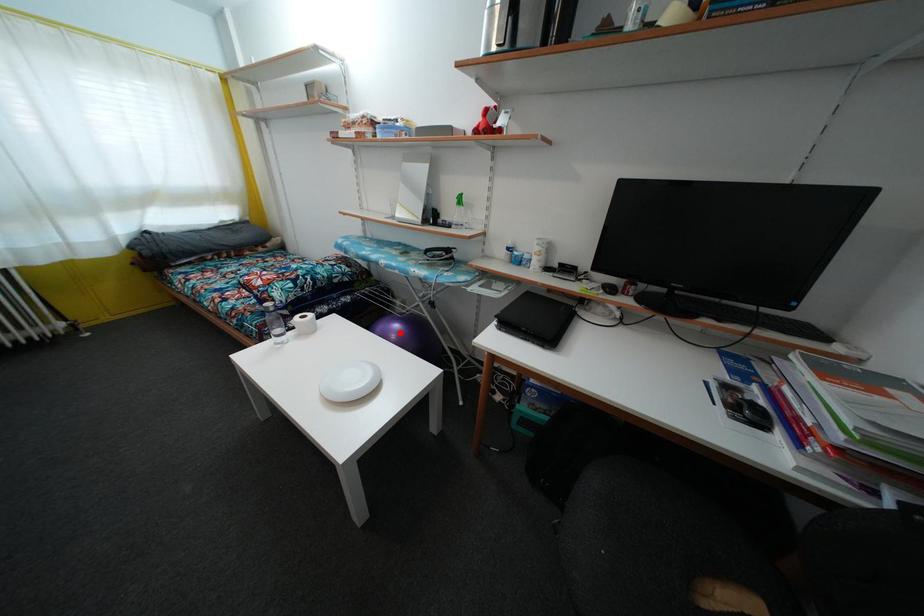
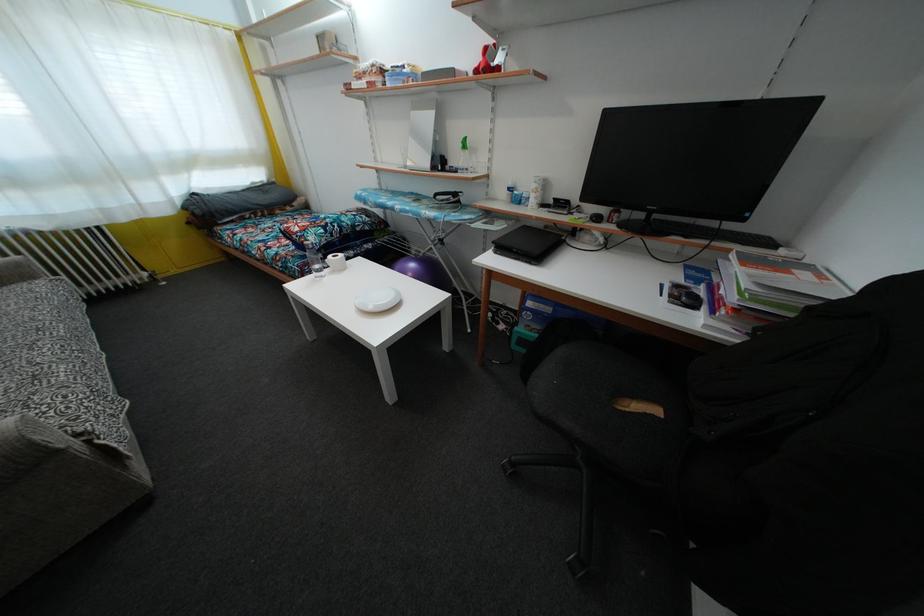
The point at the highlighted location is marked in the first image. Where is the corresponding point in the second image?

(416, 272)